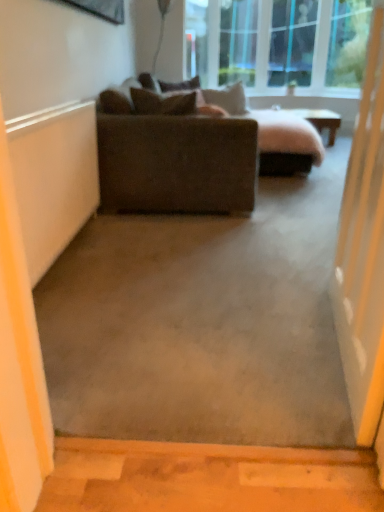
Question: Considering their positions, is suede-like brown pillow at upper center, which ranks as the 4th pillow in front-to-back order, located in front of or behind suede-like brown pillow at upper center, which is counted as the second pillow, starting from the front?

Choices:
 (A) front
 (B) behind

Answer: (B)

Question: In the image, is suede-like brown pillow at upper center, which ranks as the 4th pillow in front-to-back order, on the left side or the right side of suede-like brown pillow at upper center, which is counted as the second pillow, starting from the front?

Choices:
 (A) right
 (B) left

Answer: (B)

Question: Estimate the real-world distances between objects in this image. Which object is closer to the suede-like brown pillow at upper center, which ranks as the 4th pillow in front-to-back order?

Choices:
 (A) suede-like brown pillow at upper center, marked as the 4th pillow in a back-to-front arrangement
 (B) dark brown fabric couch at center
 (C) transparent glass screen door at right
 (D) suede-like brown pillow at upper center, which is counted as the second pillow, starting from the front
 (E) smooth concrete at bottom

Answer: (D)

Question: Which object is the farthest from the transparent glass screen door at right?

Choices:
 (A) suede-like brown pillow at upper center, which ranks as the 4th pillow in front-to-back order
 (B) suede-like brown pillow at upper center, which appears as the first pillow when viewed from the front
 (C) suede-like beige pillow at upper center, which is the third pillow in front-to-back order
 (D) dark brown fabric couch at center
 (E) suede-like brown pillow at upper center, which is counted as the second pillow, starting from the front

Answer: (C)